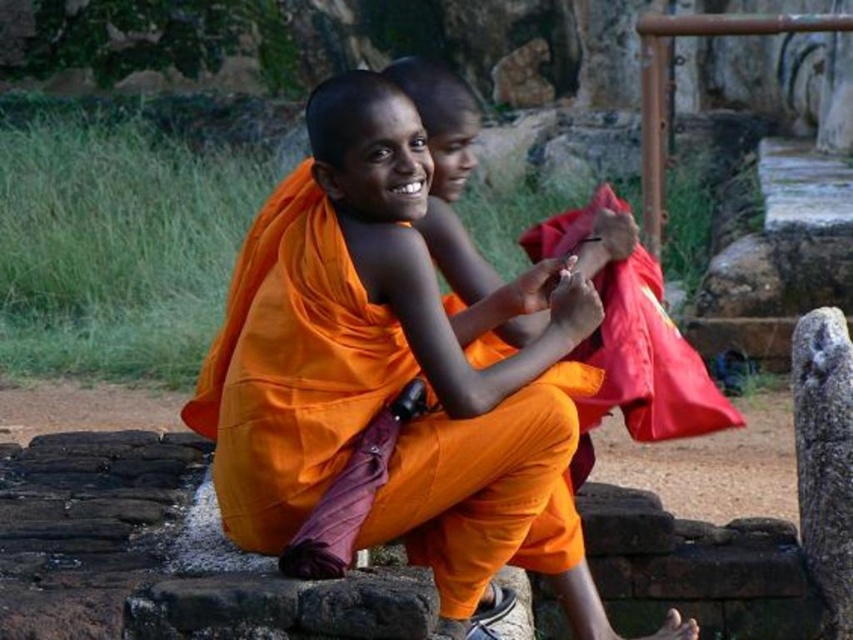
Can you confirm if orange cloth at center is taller than red cloth at center?

Yes.

Who is more distant from viewer, (x=569, y=452) or (x=592, y=202)?

The point (x=592, y=202) is more distant.

In order to click on orange cloth at center in this screenshot , I will do `click(393, 371)`.